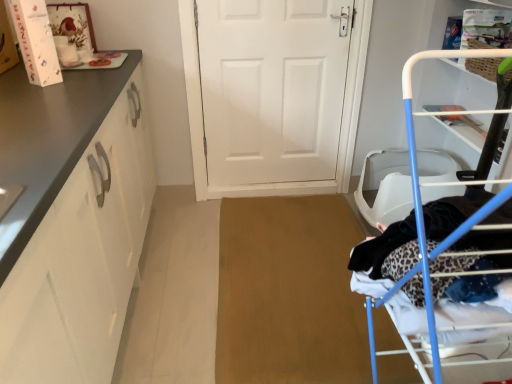
The image size is (512, 384). What do you see at coordinates (71, 220) in the screenshot?
I see `matte white cabinet at left` at bounding box center [71, 220].

At what (x,y) coordinates should I click in order to perform the action: click on blue metal drying rack at right. Please return your answer as a coordinate pair (x, y). Image resolution: width=512 pixels, height=384 pixels. Looking at the image, I should click on (443, 242).

From a real-world perspective, which object stands above the other?

From a 3D spatial view, blue metal drying rack at right is above.

Can we say blue metal drying rack at right lies outside white matte door at center?

Indeed, blue metal drying rack at right is completely outside white matte door at center.

How many degrees apart are the facing directions of blue metal drying rack at right and white matte door at center?

91.1 degrees separate the facing orientations of blue metal drying rack at right and white matte door at center.

Does point (407, 93) come in front of point (237, 162)?

Yes.

From the image's perspective, which object appears higher, matte white cabinet at left or white matte door at center?

white matte door at center appears higher in the image.

Is the position of matte white cabinet at left less distant than that of white matte door at center?

Yes, matte white cabinet at left is closer to the viewer.

How much distance is there between matte white cabinet at left and white matte door at center?

matte white cabinet at left is 3.36 feet away from white matte door at center.

Considering the sizes of blue metal drying rack at right and matte white cabinet at left in the image, is blue metal drying rack at right bigger or smaller than matte white cabinet at left?

Considering their sizes, blue metal drying rack at right takes up less space than matte white cabinet at left.

Based on the photo, in terms of width, does blue metal drying rack at right look wider or thinner when compared to matte white cabinet at left?

Considering their sizes, blue metal drying rack at right looks slimmer than matte white cabinet at left.

Is blue metal drying rack at right spatially inside matte white cabinet at left, or outside of it?

The correct answer is: outside.

Is blue metal drying rack at right far from matte white cabinet at left?

Actually, blue metal drying rack at right and matte white cabinet at left are a little close together.

Where is `furniture that is on the right side of matte white cabinet at left`? The image size is (512, 384). furniture that is on the right side of matte white cabinet at left is located at coordinates (443, 242).

Considering the sizes of objects matte white cabinet at left and blue metal drying rack at right in the image provided, who is wider, matte white cabinet at left or blue metal drying rack at right?

With larger width is matte white cabinet at left.

Does matte white cabinet at left lie in front of blue metal drying rack at right?

No.

Which object is positioned more to the left, matte white cabinet at left or blue metal drying rack at right?

Positioned to the left is matte white cabinet at left.

Is white matte door at center positioned far away from blue metal drying rack at right?

That's right, there is a large distance between white matte door at center and blue metal drying rack at right.

Considering the positions of objects white matte door at center and blue metal drying rack at right in the image provided, who is more to the left, white matte door at center or blue metal drying rack at right?

From the viewer's perspective, white matte door at center appears more on the left side.

How much distance is there between white matte door at center and blue metal drying rack at right?

They are 1.56 meters apart.

Is white matte door at center facing towards blue metal drying rack at right?

Yes, white matte door at center is oriented towards blue metal drying rack at right.

How much distance is there between white matte door at center and matte white cabinet at left?

white matte door at center is 3.36 feet from matte white cabinet at left.

From the image's perspective, is white matte door at center positioned above or below matte white cabinet at left?

white matte door at center is above matte white cabinet at left.

The width and height of the screenshot is (512, 384). What are the coordinates of `door above the matte white cabinet at left (from the image's perspective)` in the screenshot? It's located at (273, 93).

Is white matte door at center wider or thinner than matte white cabinet at left?

In the image, white matte door at center appears to be more narrow than matte white cabinet at left.

Find the location of a particular element. furniture in front of the white matte door at center is located at coordinates (443, 242).

Find the location of a particular element. Image resolution: width=512 pixels, height=384 pixels. cabinetry on the left of white matte door at center is located at coordinates (71, 220).

From the picture: Looking at the image, which one is located further to blue metal drying rack at right, matte white cabinet at left or white matte door at center?

The object further to blue metal drying rack at right is white matte door at center.

Estimate the real-world distances between objects in this image. Which object is closer to blue metal drying rack at right, white matte door at center or matte white cabinet at left?

matte white cabinet at left.

Based on their spatial positions, is blue metal drying rack at right or matte white cabinet at left further from white matte door at center?

blue metal drying rack at right is further to white matte door at center.

Estimate the real-world distances between objects in this image. Which object is further from matte white cabinet at left, white matte door at center or blue metal drying rack at right?

Based on the image, white matte door at center appears to be further to matte white cabinet at left.

When comparing their distances from matte white cabinet at left, does blue metal drying rack at right or white matte door at center seem further?

Among the two, white matte door at center is located further to matte white cabinet at left.

Estimate the real-world distances between objects in this image. Which object is closer to white matte door at center, matte white cabinet at left or blue metal drying rack at right?

The object closer to white matte door at center is matte white cabinet at left.

At what (x,y) coordinates should I click in order to perform the action: click on cabinetry between blue metal drying rack at right and white matte door at center from front to back. Please return your answer as a coordinate pair (x, y). Looking at the image, I should click on (71, 220).